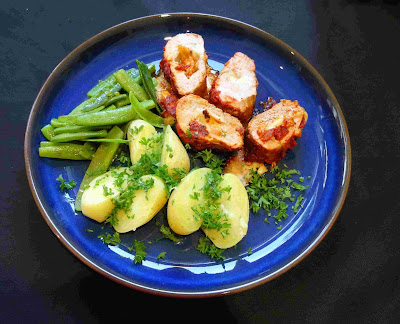
Identify the location of blue plate. The width and height of the screenshot is (400, 324). (266, 240).